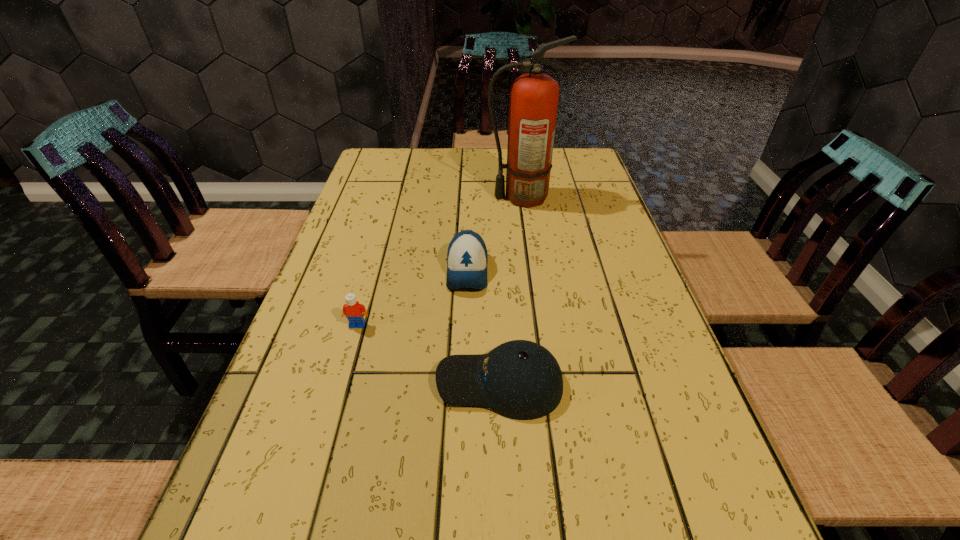
The width and height of the screenshot is (960, 540). What are the coordinates of `object that is the second closest to the second farthest object` in the screenshot? It's located at [352, 309].

This screenshot has height=540, width=960. In order to click on free space that satisfies the following two spatial constraints: 1. on the nozzle of the tallest object; 2. on the front-facing side of the second farthest object in this screenshot , I will do coord(532,271).

The width and height of the screenshot is (960, 540). What are the coordinates of `vacant region that satisfies the following two spatial constraints: 1. on the nozzle of the fire extinguisher; 2. on the front-facing side of the farther baseball cap` in the screenshot? It's located at (532, 271).

At what (x,y) coordinates should I click in order to perform the action: click on vacant region that satisfies the following two spatial constraints: 1. on the nozzle of the fire extinguisher; 2. on the front-facing side of the third nearest object. Please return your answer as a coordinate pair (x, y). Looking at the image, I should click on click(x=532, y=271).

Locate an element on the screen. The image size is (960, 540). vacant space that satisfies the following two spatial constraints: 1. on the nozzle of the tallest object; 2. on the face of the leftmost object is located at coordinates (540, 325).